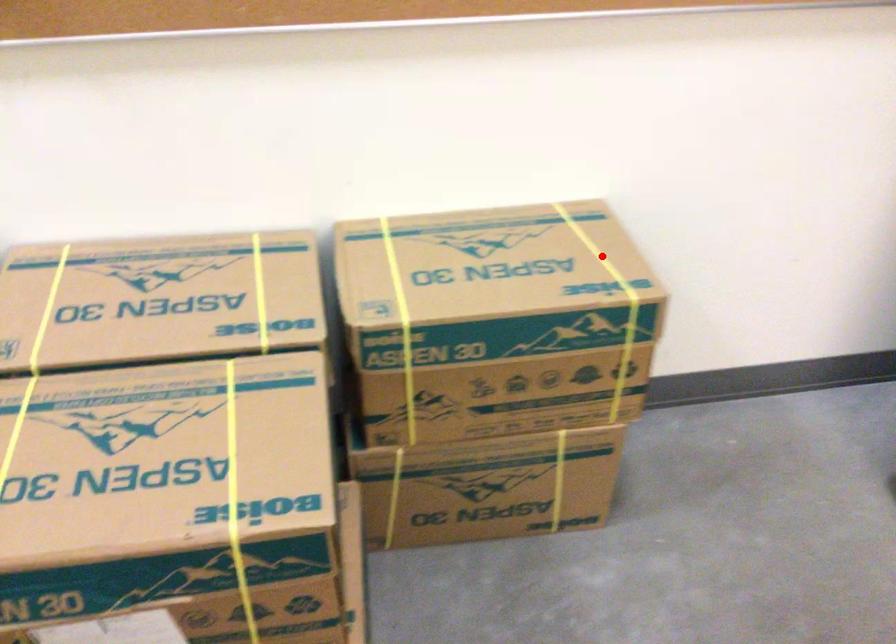
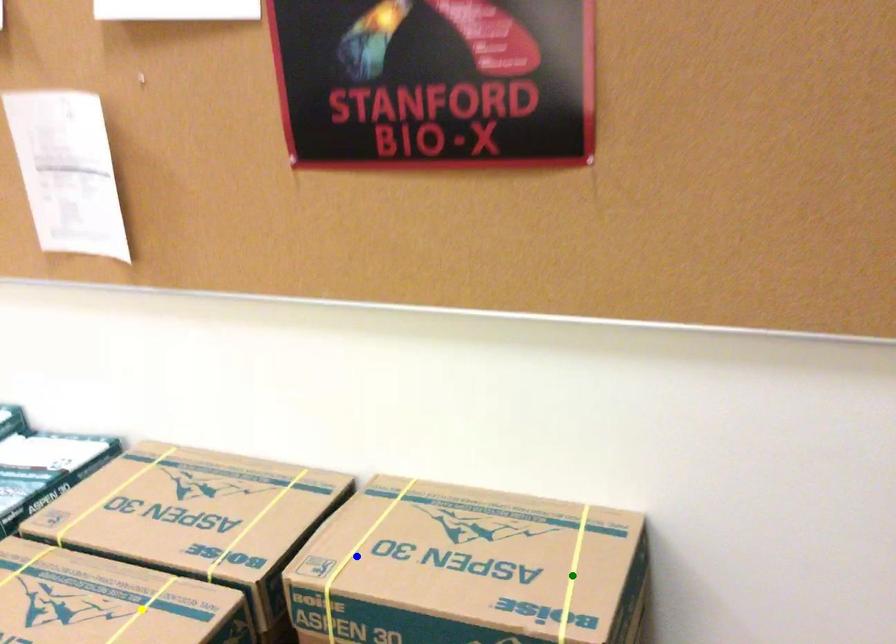
Question: I am providing you with two images of the same scene from different viewpoints. A red point is marked on the first image. You are given multiple points on the second image. Which spot in image 2 lines up with the point in image 1?

Choices:
 (A) blue point
 (B) yellow point
 (C) green point

Answer: (C)